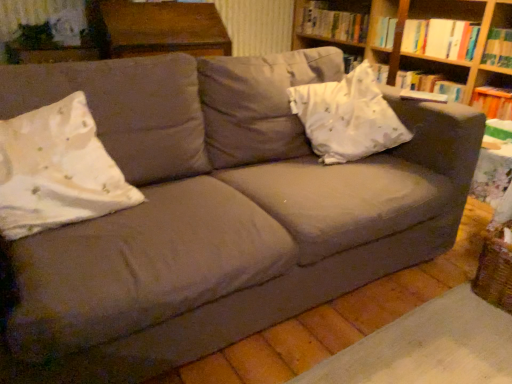
Question: Is wooden table at upper center at the right side of white satin pillow at upper right, the 2th throw pillow viewed from the left?

Choices:
 (A) no
 (B) yes

Answer: (A)

Question: Is wooden table at upper center oriented towards white satin pillow at upper right, the second throw pillow when ordered from front to back?

Choices:
 (A) yes
 (B) no

Answer: (A)

Question: Is wooden table at upper center outside of white satin pillow at upper right, the second throw pillow when ordered from front to back?

Choices:
 (A) no
 (B) yes

Answer: (B)

Question: Is white satin pillow at upper right, arranged as the 1th throw pillow when viewed from the right, located within wooden table at upper center?

Choices:
 (A) yes
 (B) no

Answer: (B)

Question: Is white satin pillow at upper right, arranged as the 1th throw pillow when viewed from the right, at the back of wooden table at upper center?

Choices:
 (A) no
 (B) yes

Answer: (A)

Question: Does wooden table at upper center have a larger size compared to white satin pillow at upper right, placed as the first throw pillow when sorted from back to front?

Choices:
 (A) yes
 (B) no

Answer: (A)

Question: Is hardcover book at upper right, the 2th book viewed from the back, further to camera compared to wooden table at upper center?

Choices:
 (A) no
 (B) yes

Answer: (B)

Question: Can you confirm if hardcover book at upper right, which is the 1th book from front to back, is positioned to the left of wooden table at upper center?

Choices:
 (A) yes
 (B) no

Answer: (B)

Question: Is hardcover book at upper right, the 2th book viewed from the back, located outside wooden table at upper center?

Choices:
 (A) no
 (B) yes

Answer: (B)

Question: Does hardcover book at upper right, the 2th book viewed from the back, have a greater width compared to wooden table at upper center?

Choices:
 (A) no
 (B) yes

Answer: (A)

Question: Considering the relative positions of hardcover book at upper right, which is the 1th book from front to back, and wooden table at upper center in the image provided, is hardcover book at upper right, which is the 1th book from front to back, in front of wooden table at upper center?

Choices:
 (A) yes
 (B) no

Answer: (B)

Question: Would you consider hardcover book at upper right, which is the 1th book from front to back, to be distant from wooden table at upper center?

Choices:
 (A) yes
 (B) no

Answer: (A)

Question: From a real-world perspective, is wooden bookshelf at upper right over hardcover book at right?

Choices:
 (A) no
 (B) yes

Answer: (B)